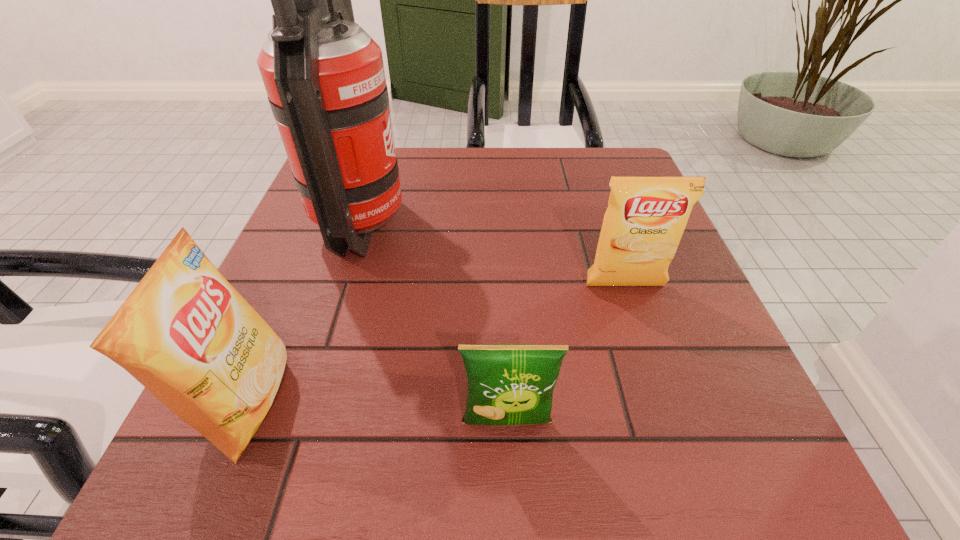
I want to click on the farthest object, so click(324, 75).

Identify the location of fire extinguisher. (324, 75).

Image resolution: width=960 pixels, height=540 pixels. Find the location of `the leftmost crisp (potato chip)`. the leftmost crisp (potato chip) is located at coordinates (185, 333).

The height and width of the screenshot is (540, 960). What are the coordinates of `the rightmost crisp (potato chip)` in the screenshot? It's located at coord(642,227).

Image resolution: width=960 pixels, height=540 pixels. Find the location of `the farthest crisp (potato chip)`. the farthest crisp (potato chip) is located at coordinates (642, 227).

This screenshot has width=960, height=540. What are the coordinates of `the second crisp (potato chip) from left to right` in the screenshot? It's located at (508, 384).

The image size is (960, 540). I want to click on the shortest object, so click(508, 384).

This screenshot has height=540, width=960. In order to click on vacant space located on the front label side of the farthest object in this screenshot , I will do `click(524, 225)`.

The image size is (960, 540). Find the location of `vacant space located 0.200m on the front-facing side of the leftmost crisp (potato chip)`. vacant space located 0.200m on the front-facing side of the leftmost crisp (potato chip) is located at coordinates (429, 402).

Locate an element on the screen. free region located on the front of the farthest crisp (potato chip) with the logo is located at coordinates (666, 412).